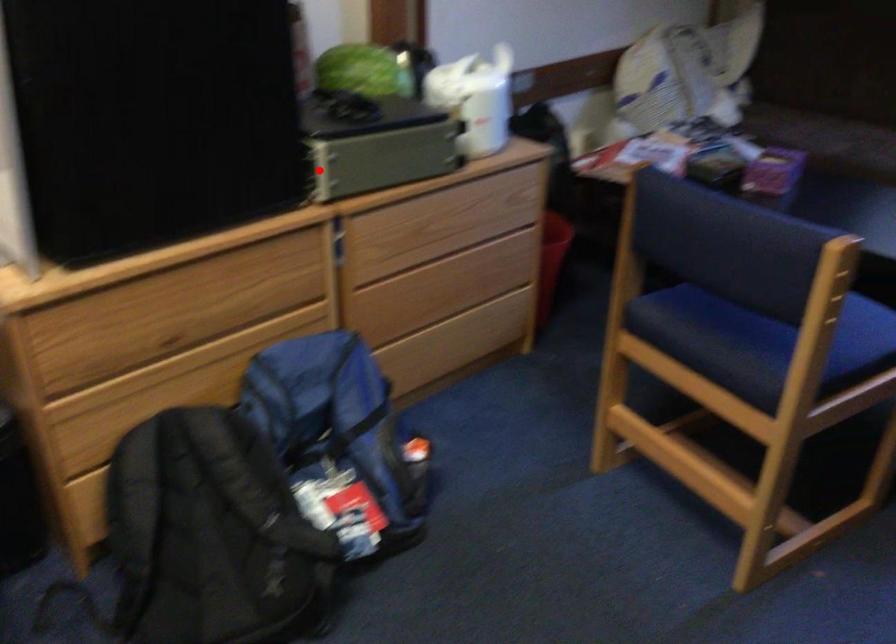
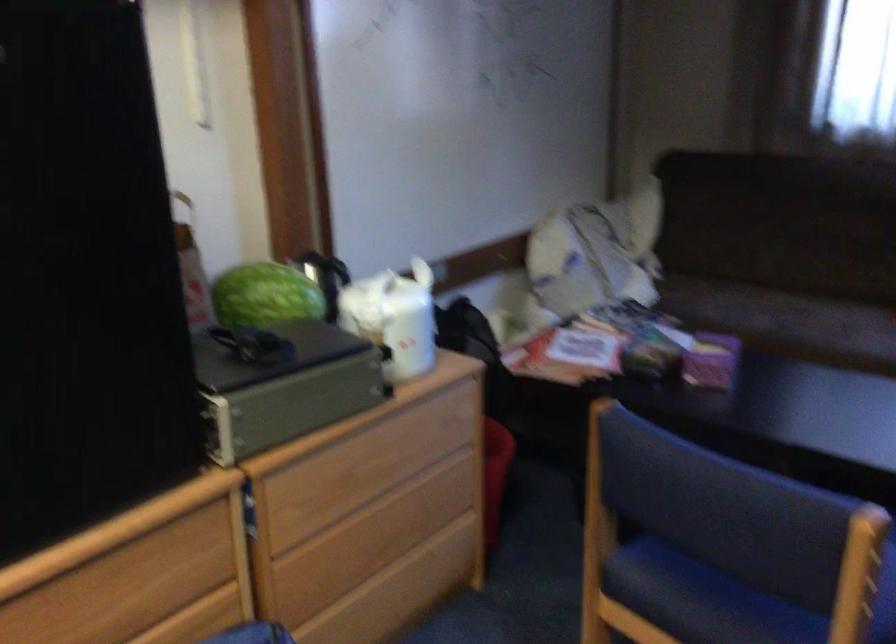
Where in the second image is the point corresponding to the highlighted location from the first image?

(222, 433)